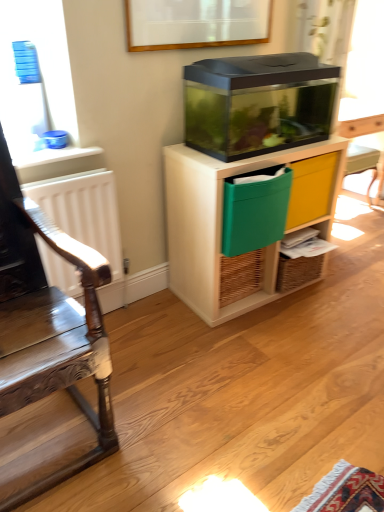
Question: Considering the positions of wooden polished chair at left and green fabric drawer at center-right in the image, is wooden polished chair at left taller or shorter than green fabric drawer at center-right?

Choices:
 (A) tall
 (B) short

Answer: (A)

Question: Is wooden polished chair at left to the left or to the right of green fabric drawer at center-right in the image?

Choices:
 (A) left
 (B) right

Answer: (A)

Question: Which is farther from the green fabric crate at center?

Choices:
 (A) green fabric drawer at center-right
 (B) transparent plastic cabinet at center
 (C) white matte radiator at left
 (D) wooden polished chair at left

Answer: (D)

Question: Which object is the farthest from the green fabric crate at center?

Choices:
 (A) white matte radiator at left
 (B) wooden polished chair at left
 (C) green fabric drawer at center-right
 (D) transparent plastic cabinet at center

Answer: (B)